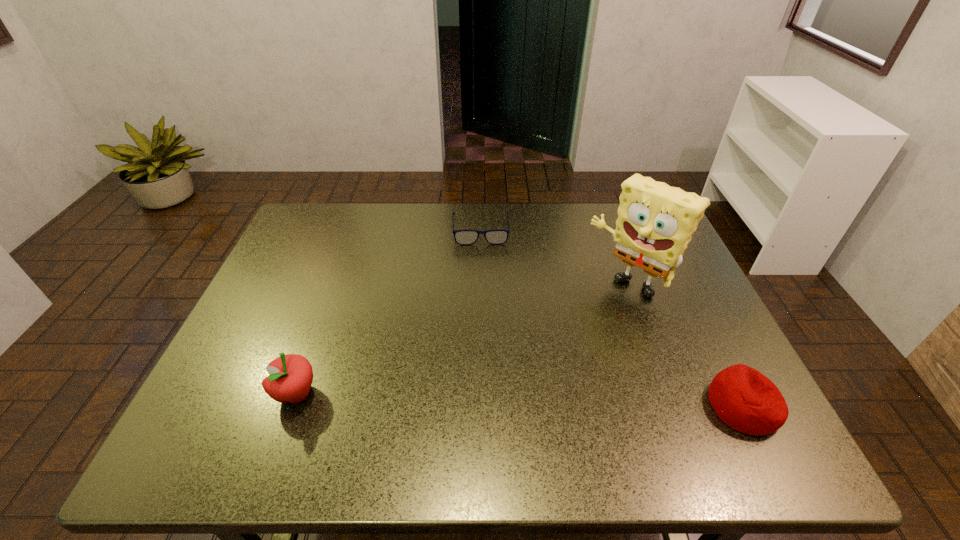
Find the location of a particular element. vacant region located 0.100m on the front-facing side of the shortest object is located at coordinates click(x=483, y=267).

I want to click on vacant region located on the front-facing side of the shortest object, so click(x=487, y=332).

The width and height of the screenshot is (960, 540). Find the location of `vacant region located on the face of the tallest object`. vacant region located on the face of the tallest object is located at coordinates (555, 354).

Find the location of `vacant region located on the face of the tallest object`. vacant region located on the face of the tallest object is located at coordinates (576, 332).

You are a GUI agent. You are given a task and a screenshot of the screen. Output one action in this format:
    pyautogui.click(x=<x>, y=<y>)
    Task: Click on the vacant region located 0.190m on the face of the tallest object
    
    Given the screenshot: What is the action you would take?
    pyautogui.click(x=564, y=344)

The height and width of the screenshot is (540, 960). What are the coordinates of `object that is positioned at the far edge` in the screenshot? It's located at (462, 237).

Identify the location of apple that is at the near edge. (290, 377).

Locate an element on the screen. Image resolution: width=960 pixels, height=540 pixels. beanbag present at the near edge is located at coordinates (746, 400).

Where is `object that is positioned at the left edge`? Image resolution: width=960 pixels, height=540 pixels. object that is positioned at the left edge is located at coordinates (290, 377).

I want to click on beanbag that is at the right edge, so click(746, 400).